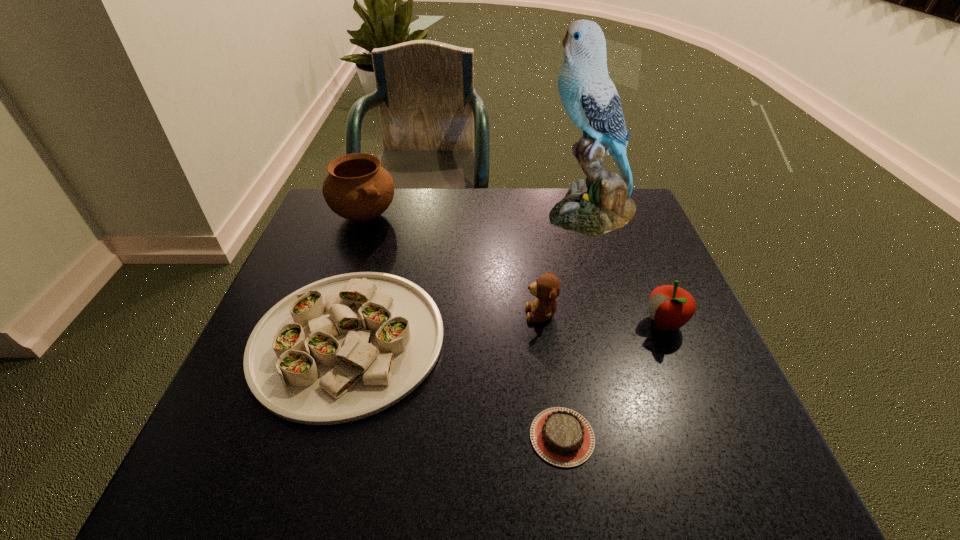
Find the location of `the tallest object`. the tallest object is located at coordinates (589, 96).

Find the location of a particular element. pottery is located at coordinates (357, 188).

At what (x,y) coordinates should I click in order to perform the action: click on apple. Please return your answer as a coordinate pair (x, y). Looking at the image, I should click on (671, 307).

The width and height of the screenshot is (960, 540). I want to click on teddy bear, so click(547, 288).

Image resolution: width=960 pixels, height=540 pixels. Find the location of `platter`. platter is located at coordinates pyautogui.click(x=346, y=347).

Locate an element on the screen. Image resolution: width=960 pixels, height=540 pixels. chocolate cake is located at coordinates [x=561, y=436].

Where is `free space located 0.220m on the face of the parakeet`? This screenshot has width=960, height=540. free space located 0.220m on the face of the parakeet is located at coordinates (463, 213).

Find the location of a particular element. vacant space located 0.240m on the face of the parakeet is located at coordinates (456, 213).

You are a GUI agent. You are given a task and a screenshot of the screen. Output one action in this format:
    pyautogui.click(x=<x>, y=<y>)
    Task: Click on the vacant region located 0.240m on the face of the parakeet
    The width and height of the screenshot is (960, 540).
    Given the screenshot: What is the action you would take?
    point(456,213)

You are a GUI agent. You are given a task and a screenshot of the screen. Output one action in this format:
    pyautogui.click(x=<x>, y=<y>)
    Task: Click on the blank space located on the front of the fifth shortest object
    This screenshot has width=960, height=540.
    Given the screenshot: What is the action you would take?
    pyautogui.click(x=339, y=292)